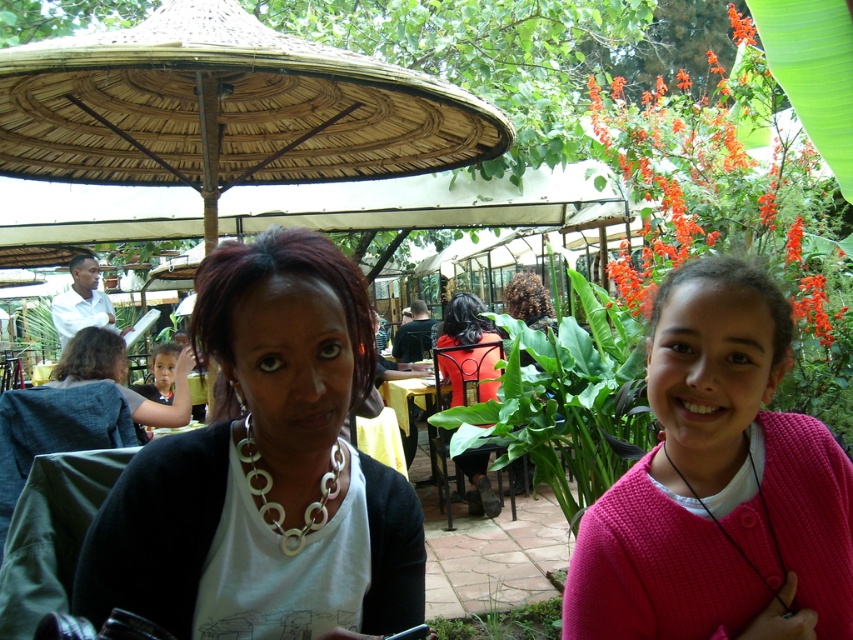
In the scene shown: You are a photographer trying to capture a closeup of the silver metallic necklace at center without the pink knitted sweater at center blocking the view. Is this possible given their positions?

The silver metallic necklace at center is closer to the viewer than the pink knitted sweater at center, so you can capture a closeup of the silver metallic necklace at center without the pink knitted sweater at center blocking the view.

You are a photographer trying to capture a closeup shot of the silver metallic necklace at center and the pink knitted sweater at center. Which object should you zoom in on to ensure both are in focus without moving the camera?

The silver metallic necklace at center is closer to the camera than the pink knitted sweater at center, so you should focus on the silver metallic necklace at center to ensure both are in focus.